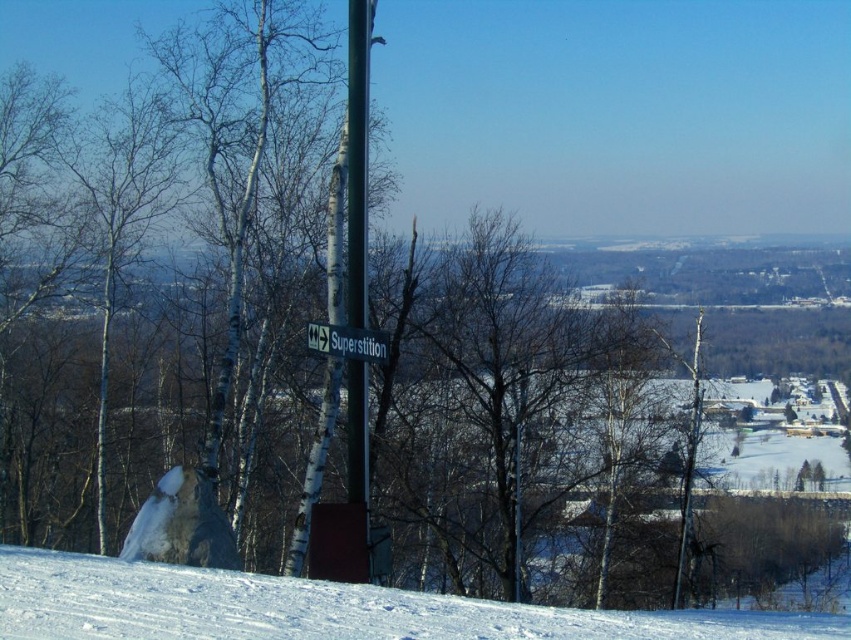
You are an outdoor photographer trying to capture a clear shot of the white plastic street sign at center. However, the white powdery snow at lower center is blocking part of the sign. Can you determine if the snow is below the sign or above it?

The white powdery snow at lower center is positioned under the white plastic street sign at center, so the snow is below the sign and not blocking the top part of it.

You are a photographer wanting to capture the white plastic street sign at center clearly. Since the white powdery snow at lower center might reflect too much light, could the snow be a problem for the photo? Explain why or why not based on their sizes.

The white powdery snow at lower center occupies less space than the white plastic street sign at center. Since the snow takes up less area in the frame, it may not reflect enough light to significantly impact the exposure of the street sign, making it easier to capture clearly.

You are standing at the point marked by the coordinates point (320, 609) in the winter landscape. What terrain feature are you currently standing on?

The point (320, 609) marks white powdery snow at lower center, so you are standing on white powdery snow at lower center.